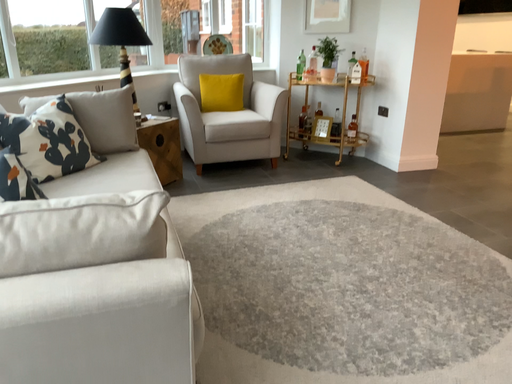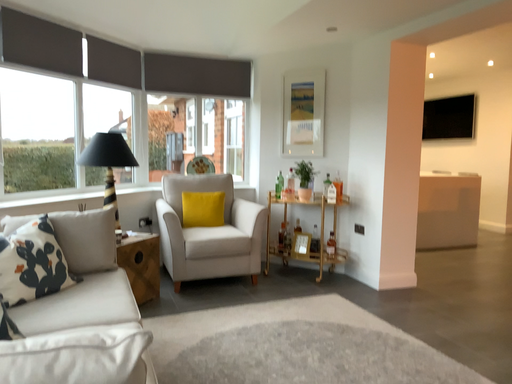
Question: Which way did the camera rotate in the video?

Choices:
 (A) rotated upward
 (B) rotated downward

Answer: (A)